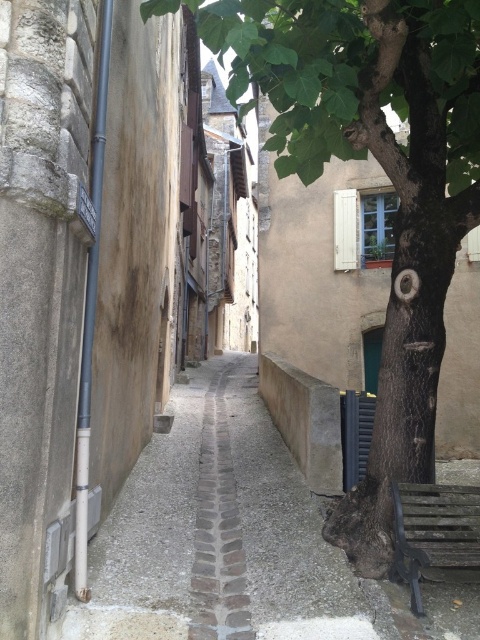
Between green rough bark tree at center and gray cobblestone alley at center, which one has more height?

With more height is green rough bark tree at center.

Can you confirm if green rough bark tree at center is positioned above gray cobblestone alley at center?

Yes.

Is point (421, 4) farther from viewer compared to point (216, 604)?

That is True.

Where is `green rough bark tree at center`? This screenshot has height=640, width=480. green rough bark tree at center is located at coordinates (385, 173).